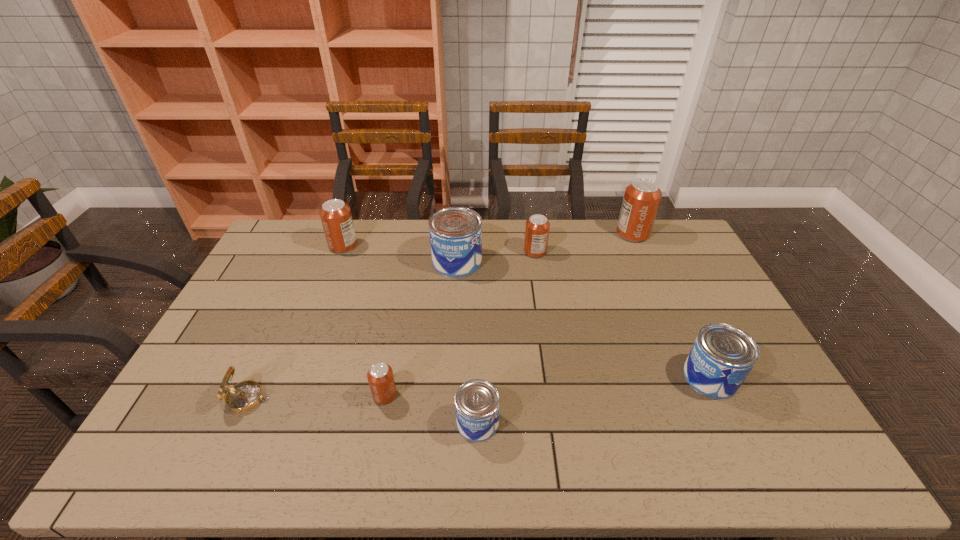
Where is `the biggest orange can`? The height and width of the screenshot is (540, 960). the biggest orange can is located at coordinates (642, 197).

You are a GUI agent. You are given a task and a screenshot of the screen. Output one action in this format:
    pyautogui.click(x=<x>, y=<y>)
    Task: Click on the tallest can
    This screenshot has height=540, width=960.
    Given the screenshot: What is the action you would take?
    pyautogui.click(x=642, y=197)

Image resolution: width=960 pixels, height=540 pixels. I want to click on the leftmost orange can, so click(335, 215).

This screenshot has width=960, height=540. Identify the location of the leftmost can. (335, 215).

The height and width of the screenshot is (540, 960). Identify the location of the farthest blue can. (455, 233).

Find the location of `the second smallest orange can`. the second smallest orange can is located at coordinates (537, 227).

At what (x,y) coordinates should I click in order to perform the action: click on the second orange can from right to left. Please return your answer as a coordinate pair (x, y). This screenshot has height=540, width=960. Looking at the image, I should click on (537, 227).

At what (x,y) coordinates should I click in order to perform the action: click on the rightmost blue can. Please return your answer as a coordinate pair (x, y). Image resolution: width=960 pixels, height=540 pixels. Looking at the image, I should click on pyautogui.click(x=722, y=356).

Where is `the second nearest blue can`? This screenshot has height=540, width=960. the second nearest blue can is located at coordinates (722, 356).

Identify the location of compass. (243, 397).